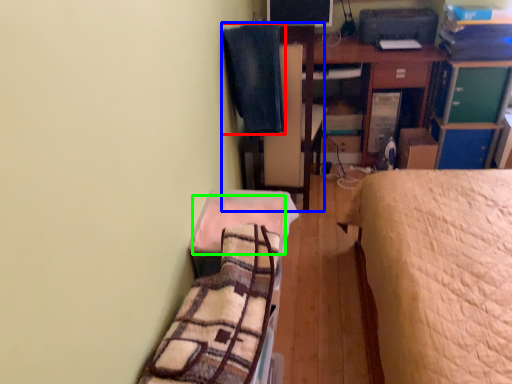
Question: Which object is the closest to the blanket (highlighted by a red box)? Choose among these: swivel chair (highlighted by a blue box) or blanket (highlighted by a green box).

Choices:
 (A) swivel chair
 (B) blanket

Answer: (A)